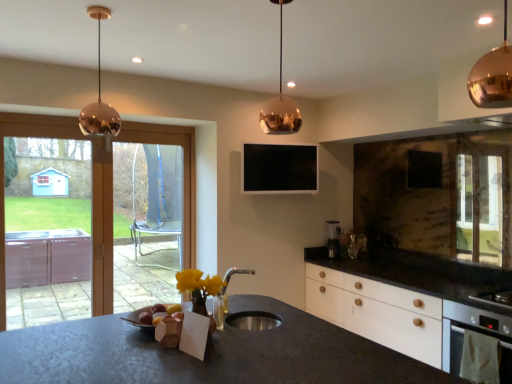
Question: Considering the positions of white matte oven at lower right and copper/metallic pendant light at upper left, the 3th lamp when ordered from right to left, in the image, is white matte oven at lower right taller or shorter than copper/metallic pendant light at upper left, the 3th lamp when ordered from right to left,?

Choices:
 (A) tall
 (B) short

Answer: (B)

Question: In the image, is white matte oven at lower right positioned in front of or behind copper/metallic pendant light at upper left, which is the third lamp from front to back?

Choices:
 (A) behind
 (B) front

Answer: (A)

Question: Estimate the real-world distances between objects in this image. Which object is farther from the copper/metallic pendant light at upper right, the third lamp in the left-to-right sequence?

Choices:
 (A) transparent glass screen door at left, the 2th screen door when ordered from back to front
 (B) matte brown bread at center
 (C) black glossy tv at upper center
 (D) white matte oven at lower right
 (E) copper metallic pendant light at upper center, the second lamp when ordered from back to front

Answer: (A)

Question: Which object is the closest to the copper/metallic pendant light at upper right, the first lamp viewed from the front?

Choices:
 (A) satin silver coffee machine at right
 (B) clear glass screen door at left, which is the 2th screen door in front-to-back order
 (C) transparent glass screen door at left, the first screen door from the front
 (D) copper metallic pendant light at upper center, the second lamp when ordered from back to front
 (E) black glossy tv at upper center

Answer: (D)